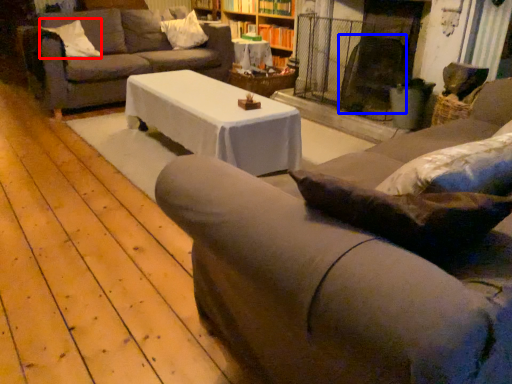
Question: Which object is further to the camera taking this photo, pillow (highlighted by a red box) or swivel chair (highlighted by a blue box)?

Choices:
 (A) pillow
 (B) swivel chair

Answer: (A)